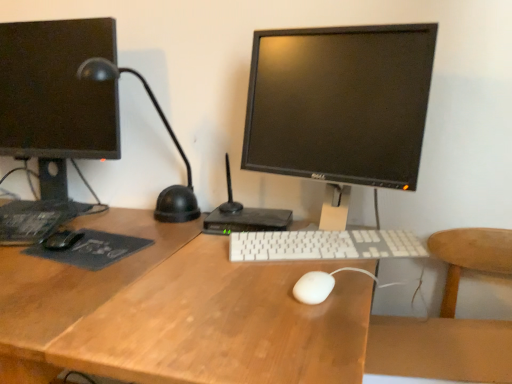
At what (x,y) coordinates should I click in order to perform the action: click on vacant space to the left of white matte mouse at center, arranged as the second mouse when viewed from the top. Please return your answer as a coordinate pair (x, y). Image resolution: width=512 pixels, height=384 pixels. Looking at the image, I should click on (220, 289).